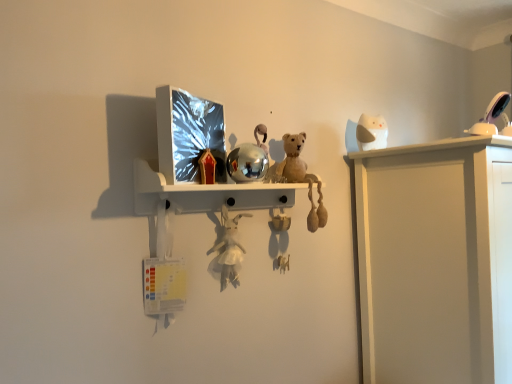
Question: From a real-world perspective, relative to white plush toy at center, the third toy viewed from the top, is white matte owl at upper right, the 3th toy in the front-to-back sequence, vertically above or below?

Choices:
 (A) above
 (B) below

Answer: (A)

Question: In terms of height, does white matte owl at upper right, which is counted as the 2th toy, starting from the right, look taller or shorter compared to white plush toy at center, the third toy viewed from the top?

Choices:
 (A) short
 (B) tall

Answer: (A)

Question: Estimate the real-world distances between objects in this image. Which object is closer to the white matte owl at upper right, which is counted as the 2th toy, starting from the right?

Choices:
 (A) white glossy lamp at upper right, acting as the 2th toy starting from the front
 (B) white plush toy at center, placed as the third toy when sorted from right to left

Answer: (A)

Question: Based on their relative distances, which object is nearer to the white matte owl at upper right, the 3th toy in the front-to-back sequence?

Choices:
 (A) white glossy lamp at upper right, the 3th toy viewed from the left
 (B) white plush toy at center, the third toy viewed from the top

Answer: (A)